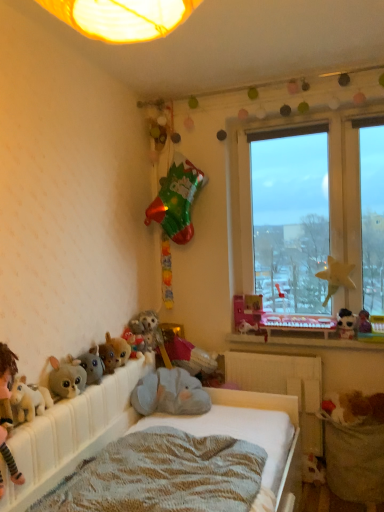
You are a GUI agent. You are given a task and a screenshot of the screen. Output one action in this format:
    pyautogui.click(x=<x>, y=<y>)
    Task: Click on the empty space that is ontop of transparent glass window at upper right (from a real-world perspective)
    
    Given the screenshot: What is the action you would take?
    303,117